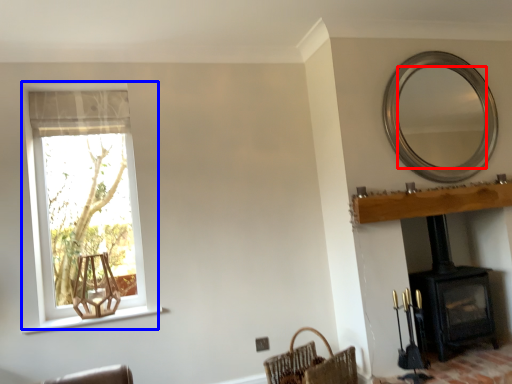
Question: Which point is further to the camera, mirror (highlighted by a red box) or window (highlighted by a blue box)?

Choices:
 (A) mirror
 (B) window

Answer: (A)